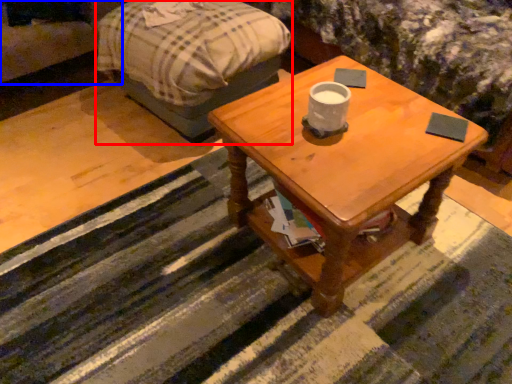
Question: Which of the following is the closest to the observer, bed frame (highlighted by a red box) or couch (highlighted by a blue box)?

Choices:
 (A) bed frame
 (B) couch

Answer: (A)